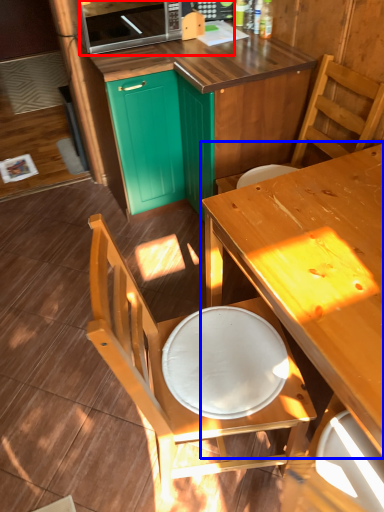
Question: Which of the following is the closest to the observer, microwave oven (highlighted by a red box) or table (highlighted by a blue box)?

Choices:
 (A) microwave oven
 (B) table

Answer: (B)